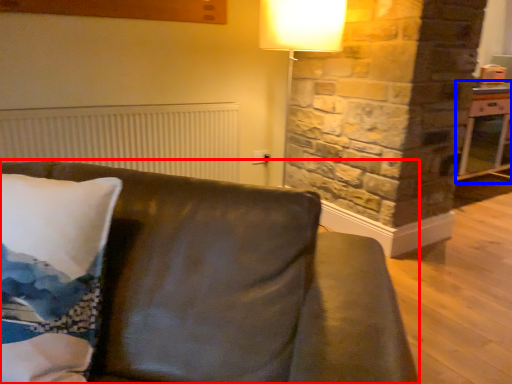
Question: Which of the following is the farthest to the observer, studio couch (highlighted by a red box) or table (highlighted by a blue box)?

Choices:
 (A) studio couch
 (B) table

Answer: (B)